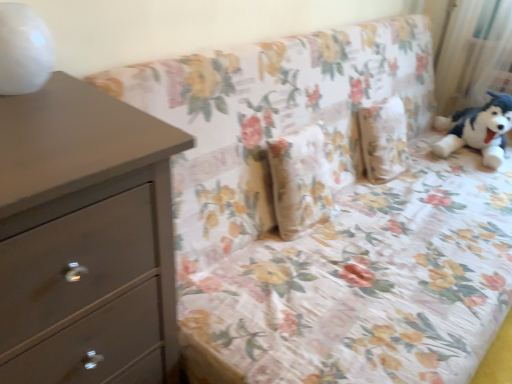
Question: Considering the relative positions of matte gray chest of drawers at left and white sheer curtain at upper right in the image provided, is matte gray chest of drawers at left to the right of white sheer curtain at upper right from the viewer's perspective?

Choices:
 (A) no
 (B) yes

Answer: (A)

Question: Is the position of matte gray chest of drawers at left more distant than that of white sheer curtain at upper right?

Choices:
 (A) no
 (B) yes

Answer: (A)

Question: Is matte gray chest of drawers at left at the left side of white sheer curtain at upper right?

Choices:
 (A) no
 (B) yes

Answer: (B)

Question: Could you tell me if matte gray chest of drawers at left is facing white sheer curtain at upper right?

Choices:
 (A) no
 (B) yes

Answer: (A)

Question: Is matte gray chest of drawers at left thinner than white sheer curtain at upper right?

Choices:
 (A) yes
 (B) no

Answer: (B)

Question: Is matte gray chest of drawers at left shorter than white sheer curtain at upper right?

Choices:
 (A) yes
 (B) no

Answer: (B)

Question: From a real-world perspective, is white sheer curtain at upper right physically above matte gray chest of drawers at left?

Choices:
 (A) yes
 (B) no

Answer: (A)

Question: Does white sheer curtain at upper right have a greater width compared to matte gray chest of drawers at left?

Choices:
 (A) yes
 (B) no

Answer: (B)

Question: Considering the relative sizes of white sheer curtain at upper right and matte gray chest of drawers at left in the image provided, is white sheer curtain at upper right taller than matte gray chest of drawers at left?

Choices:
 (A) yes
 (B) no

Answer: (B)

Question: From a real-world perspective, does white sheer curtain at upper right sit lower than matte gray chest of drawers at left?

Choices:
 (A) no
 (B) yes

Answer: (A)

Question: Would you say white sheer curtain at upper right is a long distance from matte gray chest of drawers at left?

Choices:
 (A) yes
 (B) no

Answer: (A)

Question: Is white sheer curtain at upper right closer to camera compared to matte gray chest of drawers at left?

Choices:
 (A) no
 (B) yes

Answer: (A)

Question: From a real-world perspective, is matte gray chest of drawers at left physically located above or below white sheer curtain at upper right?

Choices:
 (A) above
 (B) below

Answer: (B)